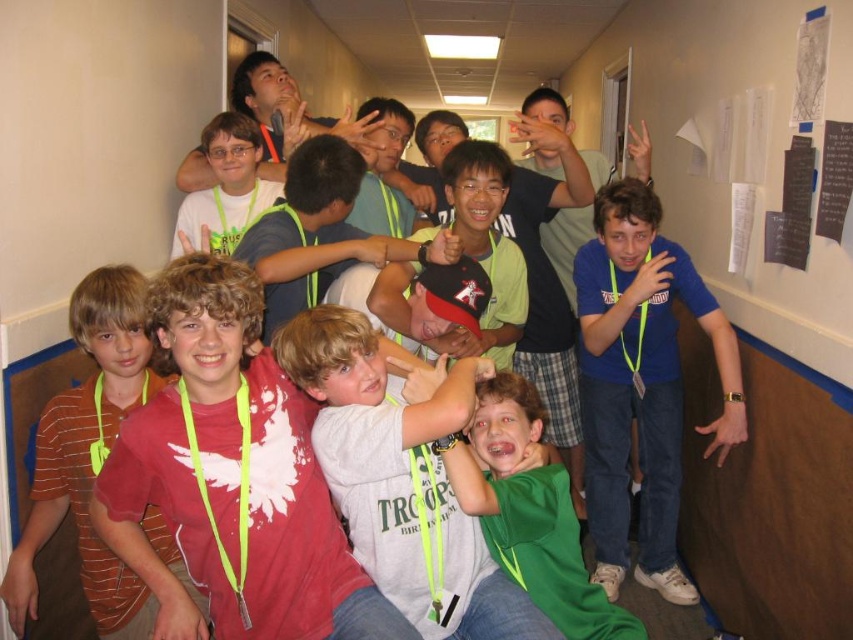
Between matte red t-shirt at center and blue t-shirt at right, which one is positioned lower?

blue t-shirt at right is below.

Between point (317, 483) and point (672, 378), which one is positioned behind?

The point (672, 378) is more distant.

Locate an element on the screen. The image size is (853, 640). matte red t-shirt at center is located at coordinates (231, 477).

Can you confirm if green matte shirt at center is positioned above matte green lanyard at center?

Incorrect, green matte shirt at center is not positioned above matte green lanyard at center.

Is point (486, 476) behind point (193, 198)?

That is False.

At what (x,y) coordinates should I click in order to perform the action: click on green matte shirt at center. Please return your answer as a coordinate pair (x, y). Looking at the image, I should click on pyautogui.click(x=529, y=513).

Is matte red t-shirt at center further to the viewer compared to matte green lanyard at center?

No, it is not.

Which of these two, matte red t-shirt at center or matte green lanyard at center, stands taller?

Standing taller between the two is matte red t-shirt at center.

Does point (160, 403) lie in front of point (227, 122)?

Yes, it is.

Identify the location of matte red t-shirt at center. This screenshot has height=640, width=853. pos(231,477).